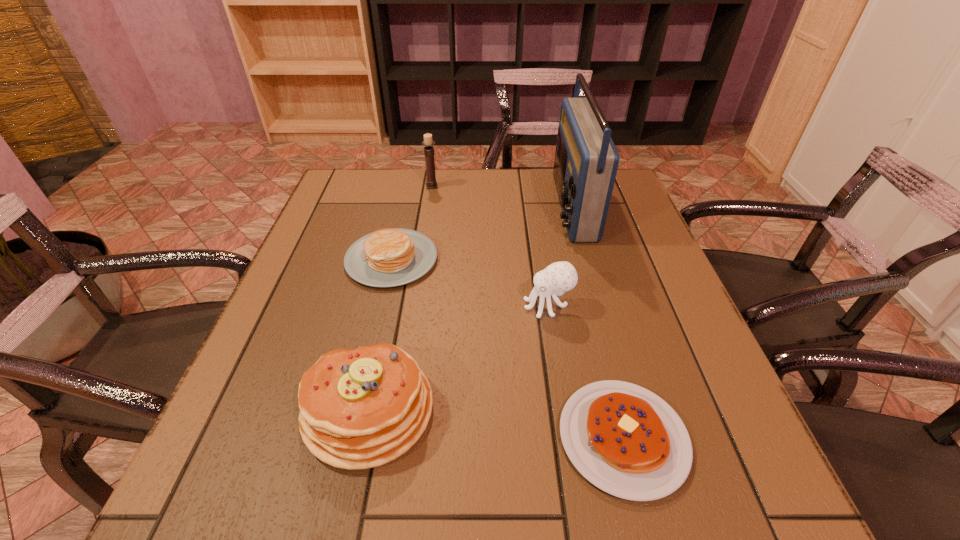
You are a GUI agent. You are given a task and a screenshot of the screen. Output one action in this format:
    pyautogui.click(x=<x>, y=<y>)
    Task: Click on the blank space located 0.400m on the front panel of the radio receiver
    This screenshot has width=960, height=540.
    Given the screenshot: What is the action you would take?
    pyautogui.click(x=409, y=207)

Identify the location of free space located on the right of the fifth shortest object. The width and height of the screenshot is (960, 540). (564, 186).

The image size is (960, 540). I want to click on free space located on the front-facing side of the octopus, so click(x=372, y=306).

Identify the location of free location located on the front-facing side of the octopus. (500, 306).

Find the location of a particular element. vacant space located 0.050m on the front-facing side of the octopus is located at coordinates (500, 306).

Locate an element on the screen. vacant point located 0.120m on the left of the tallest pancake is located at coordinates (234, 410).

Where is `vacant space located on the front of the farthest pancake`? The height and width of the screenshot is (540, 960). vacant space located on the front of the farthest pancake is located at coordinates (378, 318).

Identify the location of free space located on the left of the rightmost pancake. Image resolution: width=960 pixels, height=540 pixels. point(362,438).

Locate an element on the screen. radio receiver that is at the far edge is located at coordinates (586, 160).

You are a GUI agent. You are given a task and a screenshot of the screen. Output one action in this format:
    pyautogui.click(x=<x>, y=<y>)
    Task: Click on the candle holder that is at the far edge
    The height and width of the screenshot is (540, 960).
    Given the screenshot: What is the action you would take?
    coord(431,183)